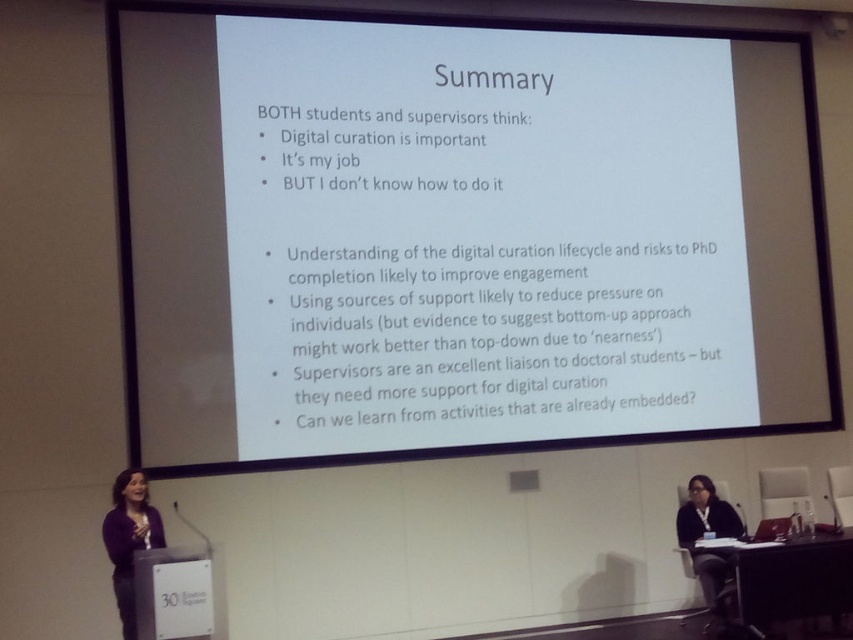
You are organizing a charity clothing drive and need to determine which items can be paired together. You have a dark purple sweater at lower left and a black fabric at lower right. Which item is smaller in size and better suited for a child?

The dark purple sweater at lower left has a smaller size compared to the black fabric at lower right, so it is better suited for a child.

You are attending a presentation and notice two items in the front row. The dark purple sweater at lower left and the black fabric at lower right. Which one is nearer to you?

The dark purple sweater at lower left is closer to the viewer than the black fabric at lower right.

You are standing in the presentation room and want to locate the dark purple sweater at lower left. Where exactly is it positioned in the room?

The dark purple sweater at lower left is positioned at point (x=129, y=540) in the room.